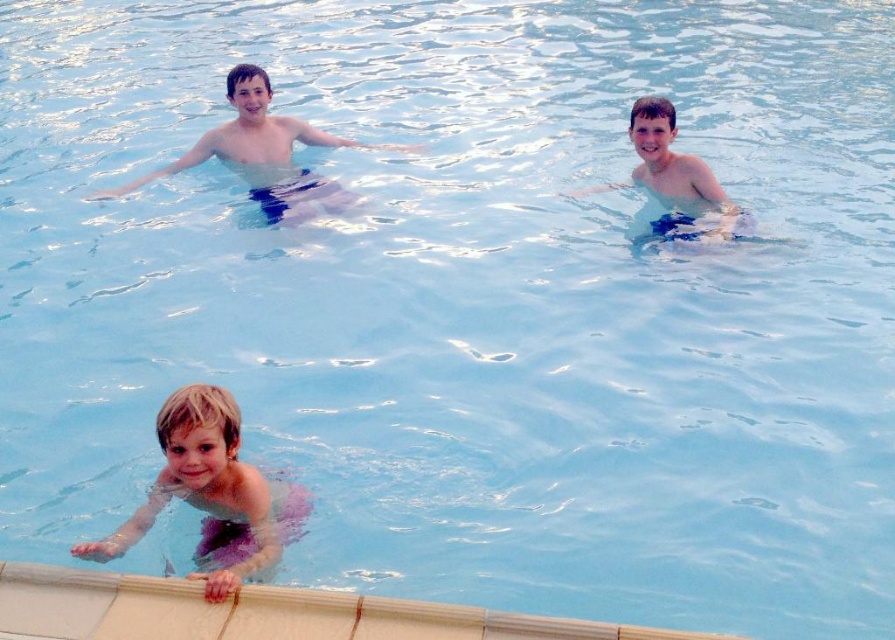
Question: Which object is closer to the camera taking this photo?

Choices:
 (A) pink fabric at lower left
 (B) matte blue shorts at upper center
 (C) blue fabric shorts at upper center

Answer: (A)

Question: Which point is closer to the camera?

Choices:
 (A) (267, 540)
 (B) (248, 97)

Answer: (A)

Question: Observing the image, what is the correct spatial positioning of matte blue shorts at upper center in reference to blue fabric shorts at upper center?

Choices:
 (A) above
 (B) below

Answer: (A)

Question: Is pink fabric at lower left to the left of blue fabric shorts at upper center from the viewer's perspective?

Choices:
 (A) yes
 (B) no

Answer: (A)

Question: Among these points, which one is nearest to the camera?

Choices:
 (A) (292, 497)
 (B) (296, 198)

Answer: (A)

Question: Is matte blue shorts at upper center closer to the viewer compared to blue fabric shorts at upper center?

Choices:
 (A) yes
 (B) no

Answer: (B)